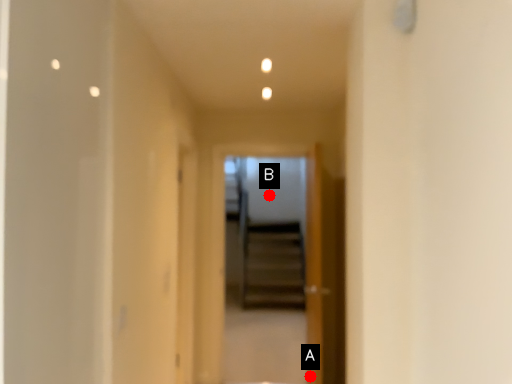
Question: Two points are circled on the image, labeled by A and B beside each circle. Which point is closer to the camera?

Choices:
 (A) A is closer
 (B) B is closer

Answer: (A)